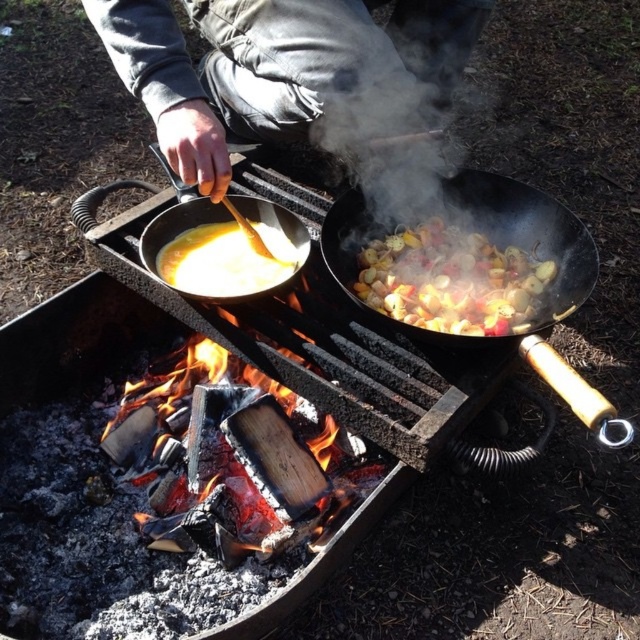
You are a chef preparing a dish and need to know which container has more depth for cooking. Based on the scene, which one is taller between the black matte wok at center and the shiny metallic vegetables at center?

The black matte wok at center is much taller than the shiny metallic vegetables at center, so it has more depth for cooking.

You are a chef standing in front of the grill setup. You need to reach for the shiny metallic vegetables at center and the yellow creamy soup at center. Which one can you grab first without moving your position?

The shiny metallic vegetables at center can be grabbed first because it is closer to you than the yellow creamy soup at center.